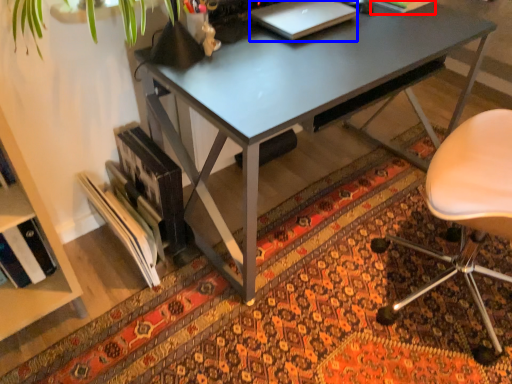
Question: Which object is closer to the camera taking this photo, book (highlighted by a red box) or laptop (highlighted by a blue box)?

Choices:
 (A) book
 (B) laptop

Answer: (B)